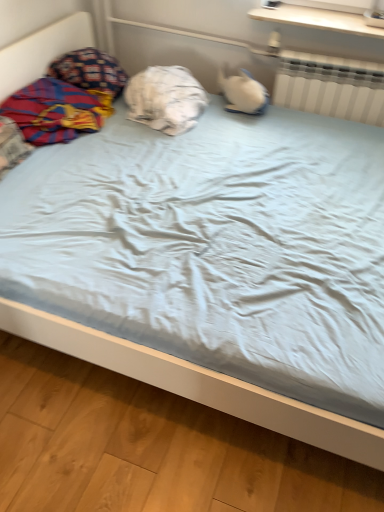
Find the location of a particular element. free location above white plastic radiator at upper right (from a real-world perspective) is located at coordinates (347, 49).